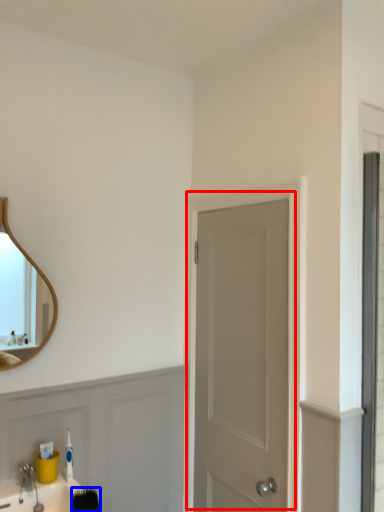
Question: Which of the following is the farthest to the observer, door (highlighted by a red box) or brush (highlighted by a blue box)?

Choices:
 (A) door
 (B) brush

Answer: (A)